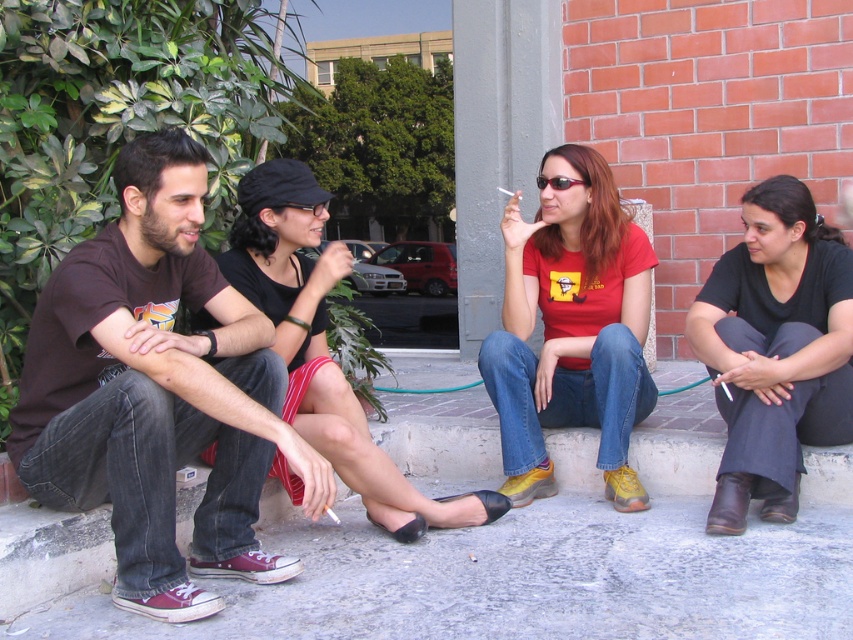
You are standing in the outdoor scene and want to reach a point that is 10 feet away from you. Is the point at coordinate point (747, 333) within your target distance?

The distance of point (747, 333) from viewer is 9.74 feet, which is less than 10 feet. Therefore, the point is within the target distance.